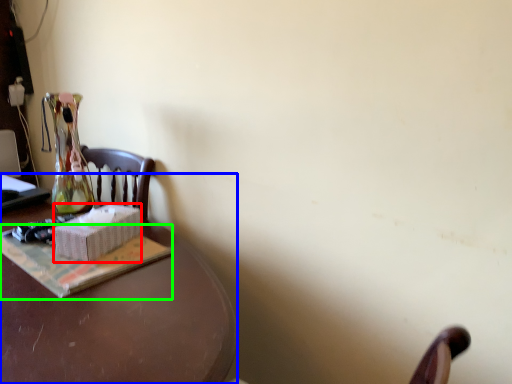
Question: Which object is positioned closest to box (highlighted by a red box)? Select from desk (highlighted by a blue box) and paperback book (highlighted by a green box).

Choices:
 (A) desk
 (B) paperback book

Answer: (B)